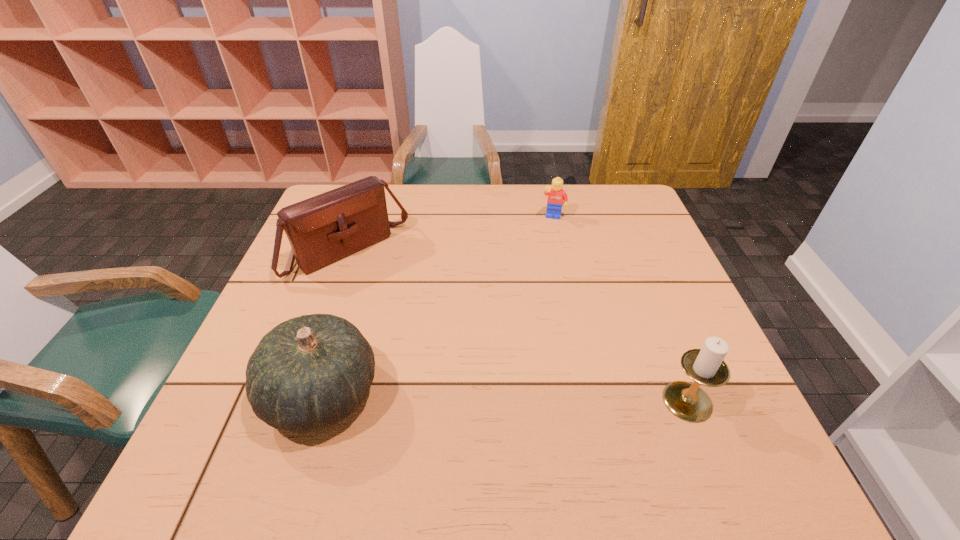
This screenshot has width=960, height=540. I want to click on free space located 0.130m on the front flap of the second farthest object, so click(x=409, y=304).

Where is `blank space located 0.110m on the front flap of the second farthest object`? Image resolution: width=960 pixels, height=540 pixels. blank space located 0.110m on the front flap of the second farthest object is located at coordinates (404, 300).

Identify the location of vacant position located on the front flap of the second farthest object. This screenshot has width=960, height=540. (401, 298).

What are the coordinates of `Lego that is at the far edge` in the screenshot? It's located at (556, 195).

I want to click on shoulder bag located in the far edge section of the desktop, so click(323, 229).

Image resolution: width=960 pixels, height=540 pixels. In order to click on gourd located at the near edge in this screenshot , I will do `click(308, 373)`.

The width and height of the screenshot is (960, 540). Find the location of `candle holder located at the near edge`. candle holder located at the near edge is located at coordinates point(706,366).

Identify the location of gourd at the left edge. (308, 373).

This screenshot has height=540, width=960. Identify the location of shoulder bag located at the left edge. (323, 229).

This screenshot has width=960, height=540. What are the coordinates of `object that is positioned at the right edge` in the screenshot? It's located at click(x=706, y=366).